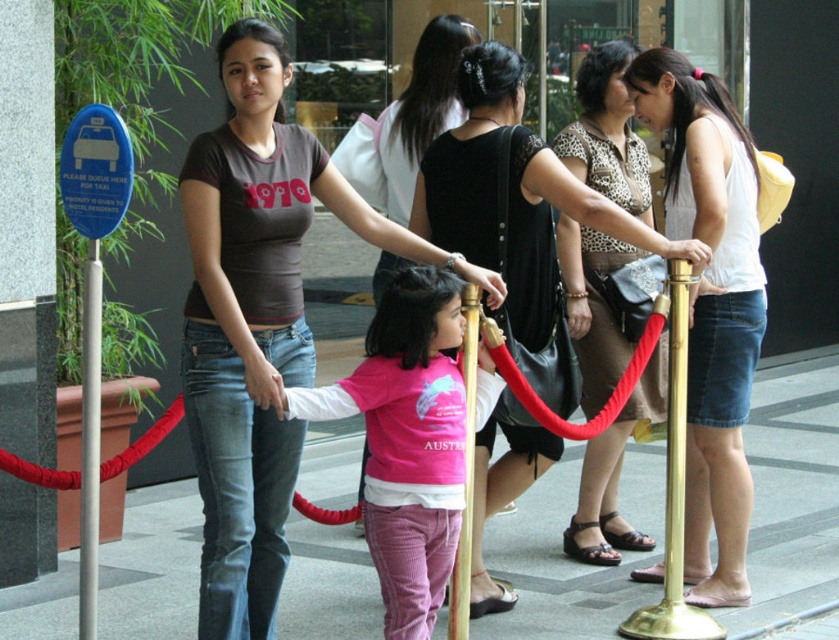
Who is positioned more to the right, leopard print blouse at center or matte black hand at center?

Result: Positioned to the right is leopard print blouse at center.

This screenshot has width=839, height=640. What do you see at coordinates (607, 132) in the screenshot?
I see `leopard print blouse at center` at bounding box center [607, 132].

Find the location of `leopard print blouse at center`. leopard print blouse at center is located at coordinates (607, 132).

Does matte pink shirt at center appear under matte black hand at center?

Correct, matte pink shirt at center is located below matte black hand at center.

Can you confirm if matte pink shirt at center is taller than matte black hand at center?

Indeed, matte pink shirt at center has a greater height compared to matte black hand at center.

Is point (268, 372) positioned in front of point (498, 280)?

Yes.

Image resolution: width=839 pixels, height=640 pixels. Find the location of `matte pink shirt at center`. matte pink shirt at center is located at coordinates (262, 380).

You are a GUI agent. You are given a task and a screenshot of the screen. Output one action in this format:
    pyautogui.click(x=<x>, y=<y>)
    Task: Click on the matte brown shirt at center
    The height and width of the screenshot is (640, 839).
    Given the screenshot: What is the action you would take?
    pyautogui.click(x=254, y=321)

Is matte brown shirt at center positioned in front of matte pink shirt at center?

No, it is behind matte pink shirt at center.

At what (x,y) coordinates should I click in order to perform the action: click on matte brown shirt at center. Please return your answer as a coordinate pair (x, y). This screenshot has height=640, width=839. Looking at the image, I should click on (254, 321).